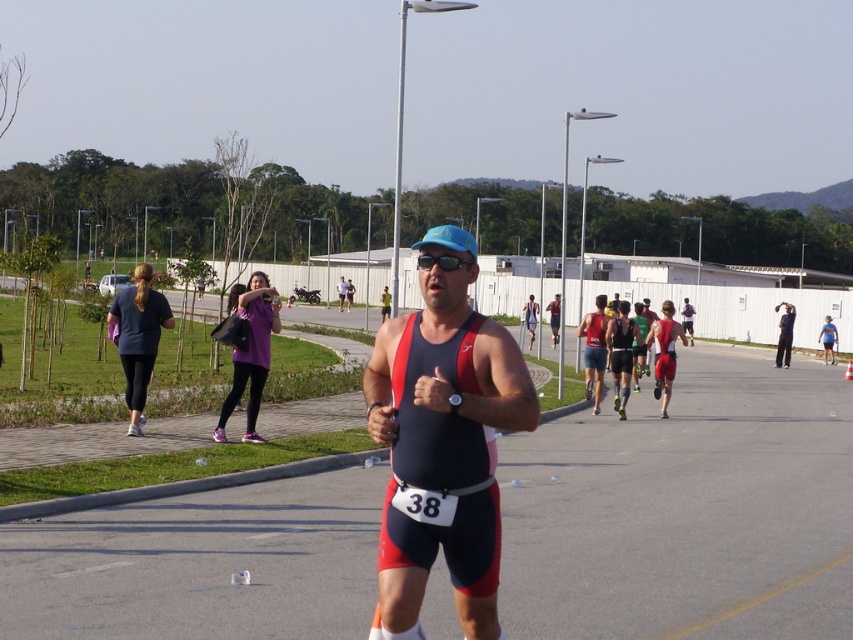
Does dark blue fabric running suit at left lie in front of purple fabric bag at upper left?

Yes, dark blue fabric running suit at left is in front of purple fabric bag at upper left.

Measure the distance between dark blue fabric running suit at left and camera.

A distance of 45.88 feet exists between dark blue fabric running suit at left and camera.

At what (x,y) coordinates should I click in order to perform the action: click on dark blue fabric running suit at left. Please return your answer as a coordinate pair (x, y). Looking at the image, I should click on (138, 337).

Measure the distance between dark blue fabric running suit at left and camera.

13.98 meters

Is dark blue fabric running suit at left wider than matte blue cap at center?

Yes, dark blue fabric running suit at left is wider than matte blue cap at center.

Is point (143, 348) more distant than point (825, 316)?

No, it is not.

You are a GUI agent. You are given a task and a screenshot of the screen. Output one action in this format:
    pyautogui.click(x=<x>, y=<y>)
    Task: Click on the dark blue fabric running suit at left
    
    Given the screenshot: What is the action you would take?
    pyautogui.click(x=138, y=337)

Is point (473, 556) positioned after point (120, 362)?

No, it is in front of (120, 362).

Between matte red and black triathlon suit at center and dark blue fabric running suit at left, which one has less height?

With less height is matte red and black triathlon suit at center.

Find the location of `matte red and black triathlon suit at center`. matte red and black triathlon suit at center is located at coordinates (444, 440).